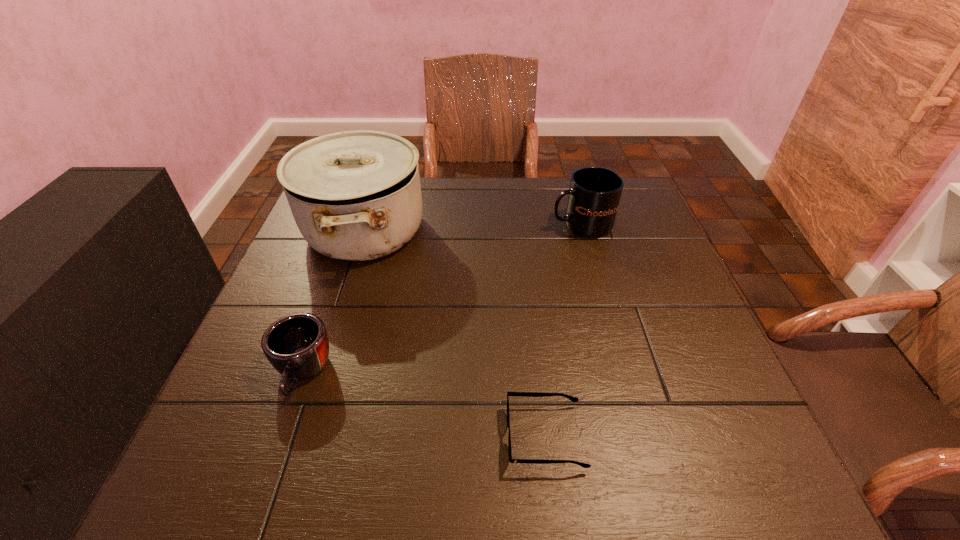
Where is `vacant space located 0.130m with the handle on the side of the right mug`? vacant space located 0.130m with the handle on the side of the right mug is located at coordinates (502, 225).

Find the location of a particular element. This screenshot has width=960, height=540. free space located 0.050m on the side of the nearer mug with the handle is located at coordinates (281, 434).

This screenshot has width=960, height=540. Identify the location of vacant space situated 0.100m on the arms of the second object from right to left. (449, 437).

You are a GUI agent. You are given a task and a screenshot of the screen. Output one action in this format:
    pyautogui.click(x=<x>, y=<y>)
    Task: Click on the vacant space located 0.090m on the arms of the second object from right to left
    
    Given the screenshot: What is the action you would take?
    pyautogui.click(x=455, y=437)

Where is `free space located on the arms of the second object from right to left`? The height and width of the screenshot is (540, 960). free space located on the arms of the second object from right to left is located at coordinates (461, 437).

Where is `saucepan that is positioned at the far edge`? The width and height of the screenshot is (960, 540). saucepan that is positioned at the far edge is located at coordinates (355, 195).

Image resolution: width=960 pixels, height=540 pixels. Find the location of `mug at the far edge`. mug at the far edge is located at coordinates (593, 197).

At what (x,y) coordinates should I click in order to perform the action: click on object at the near edge. Please return your answer as a coordinate pair (x, y). The image size is (960, 540). Looking at the image, I should click on (525, 394).

Locate an element on the screen. saucepan at the left edge is located at coordinates (355, 195).

Find the location of a particular element. mug that is at the left edge is located at coordinates (297, 346).